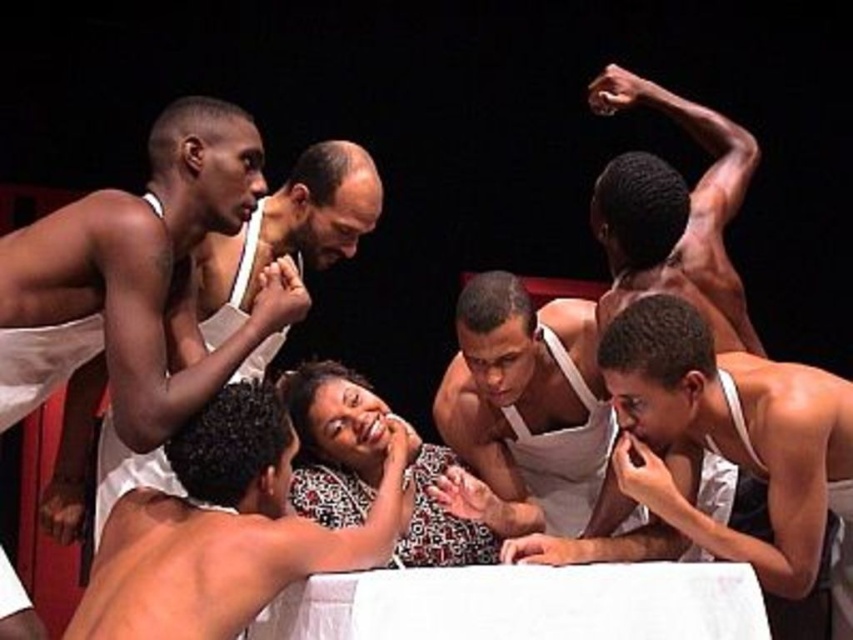
Does point (601, 362) lie behind point (102, 358)?

No, it is in front of (102, 358).

Between white fabric tank top at center and white fabric at upper left, which one has less height?

With less height is white fabric at upper left.

Is point (664, 296) farther from viewer compared to point (134, 476)?

No, (664, 296) is in front of (134, 476).

The height and width of the screenshot is (640, 853). What are the coordinates of `white fabric tank top at center` in the screenshot? It's located at (735, 442).

Who is more forward, (x=292, y=556) or (x=735, y=420)?

Point (x=292, y=556) is in front.

Is smooth skin man at center above white fabric tank top at center?

Actually, smooth skin man at center is below white fabric tank top at center.

Between point (393, 516) and point (770, 516), which one is positioned behind?

The point (393, 516) is more distant.

Where is `smooth skin man at center`? smooth skin man at center is located at coordinates click(225, 529).

From the picture: Between smooth skin man at center and patterned fabric blouse at center, which one appears on the right side from the viewer's perspective?

A: Positioned to the right is patterned fabric blouse at center.

Does smooth skin man at center have a lesser width compared to patterned fabric blouse at center?

Incorrect, smooth skin man at center's width is not less than patterned fabric blouse at center's.

Which is behind, point (207, 538) or point (364, 412)?

The point (364, 412) is more distant.

The height and width of the screenshot is (640, 853). Find the location of `smooth skin man at center`. smooth skin man at center is located at coordinates (225, 529).